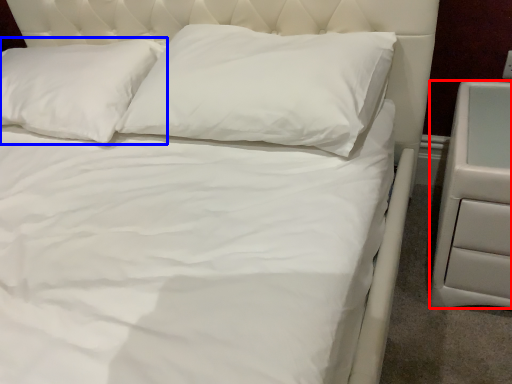
Question: Which object is closer to the camera taking this photo, nightstand (highlighted by a red box) or pillow (highlighted by a blue box)?

Choices:
 (A) nightstand
 (B) pillow

Answer: (A)